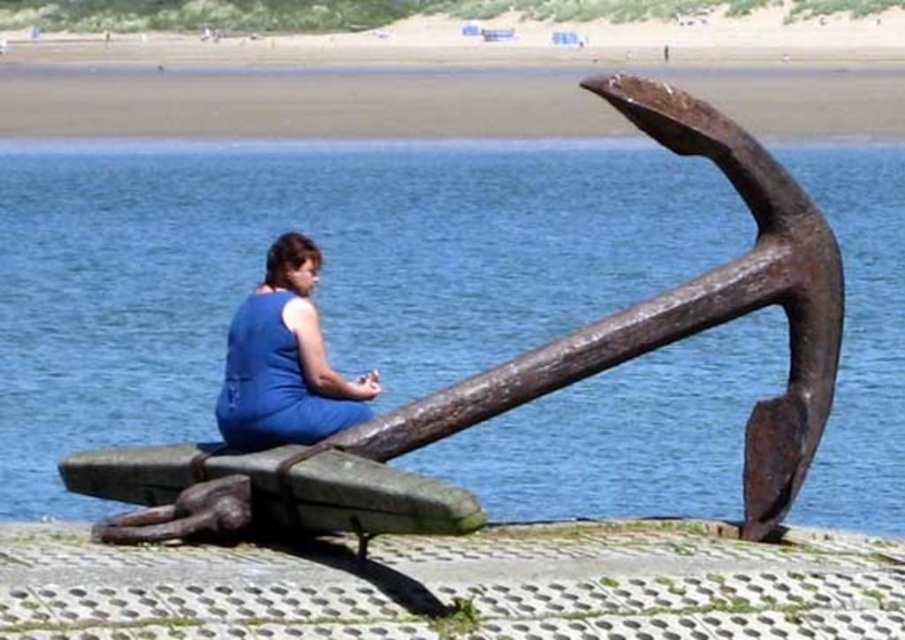
Who is more distant from viewer, (x=221, y=109) or (x=234, y=422)?

Positioned behind is point (x=221, y=109).

Describe the element at coordinates (300, 104) in the screenshot. This screenshot has width=905, height=640. I see `smooth sand at upper center` at that location.

Identify the location of smooth sand at upper center. (300, 104).

Can you confirm if rusty metal anchor at center is positioned below smooth sand at upper center?

Correct, rusty metal anchor at center is located below smooth sand at upper center.

Between point (839, 161) and point (691, 70), which one is positioned in front?

Positioned in front is point (839, 161).

Describe the element at coordinates (322, 272) in the screenshot. The image size is (905, 640). I see `rusty metal anchor at center` at that location.

Identify the location of rusty metal anchor at center. The height and width of the screenshot is (640, 905). (322, 272).

Is rusty metal anchor at center smaller than blue fabric dress at center?

Actually, rusty metal anchor at center might be larger than blue fabric dress at center.

Is point (551, 440) in front of point (294, 372)?

No, it is not.

Is point (370, 316) more distant than point (338, 424)?

Yes, it is behind point (338, 424).

The width and height of the screenshot is (905, 640). I want to click on rusty metal anchor at center, so click(322, 272).